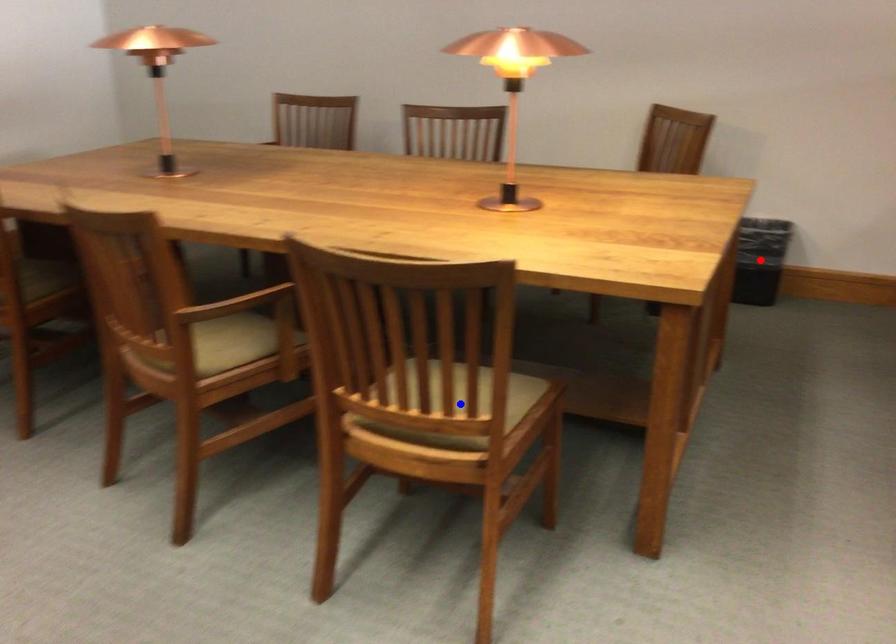
Question: Two points are marked on the image. Which point is closer to the camera?

Choices:
 (A) Blue point is closer.
 (B) Red point is closer.

Answer: (A)